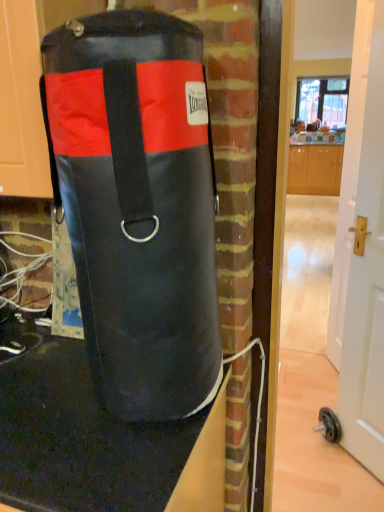
Image resolution: width=384 pixels, height=512 pixels. In order to click on vacant space in front of black leather punching bag at center in this screenshot , I will do `click(107, 468)`.